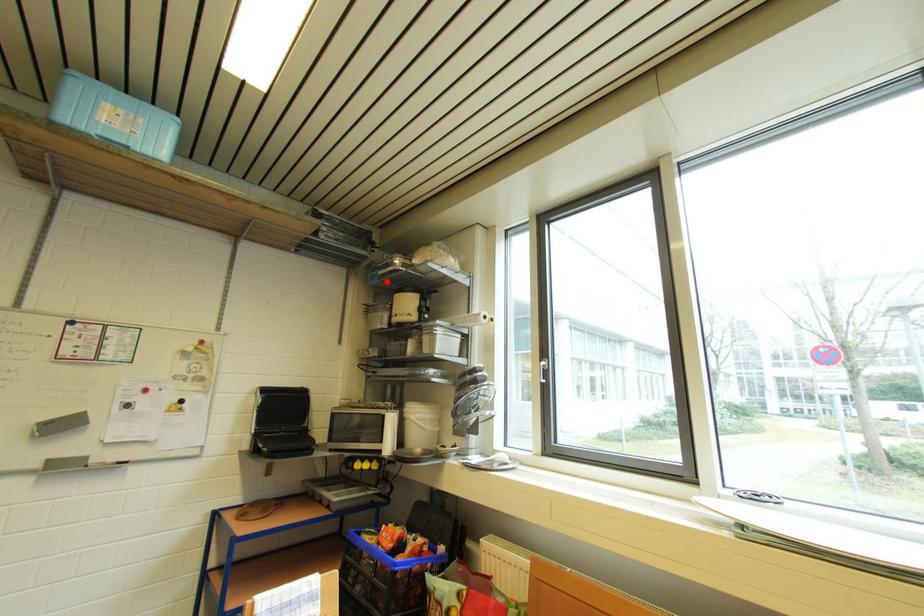
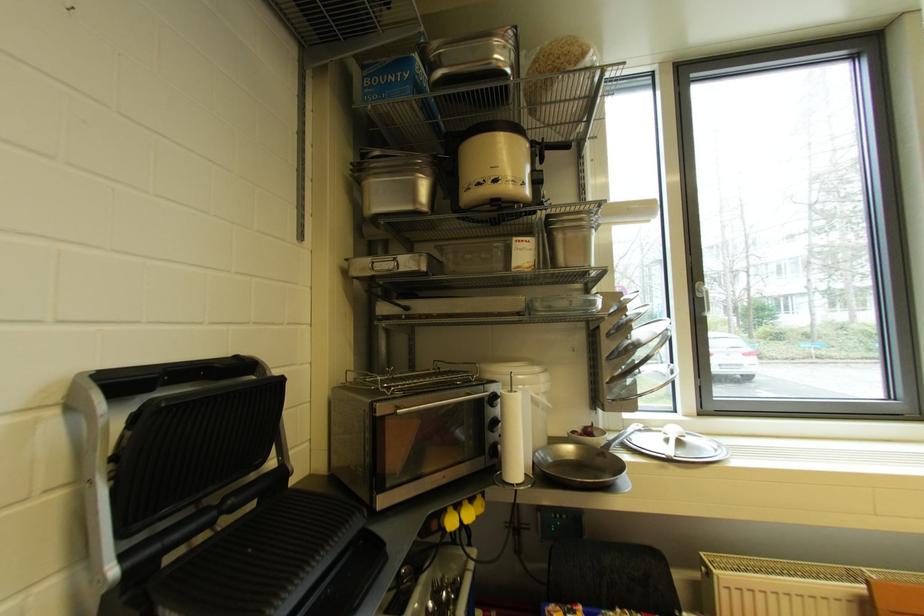
Find the pixel in the second image that matches the highlighted location in the first image.

(420, 97)